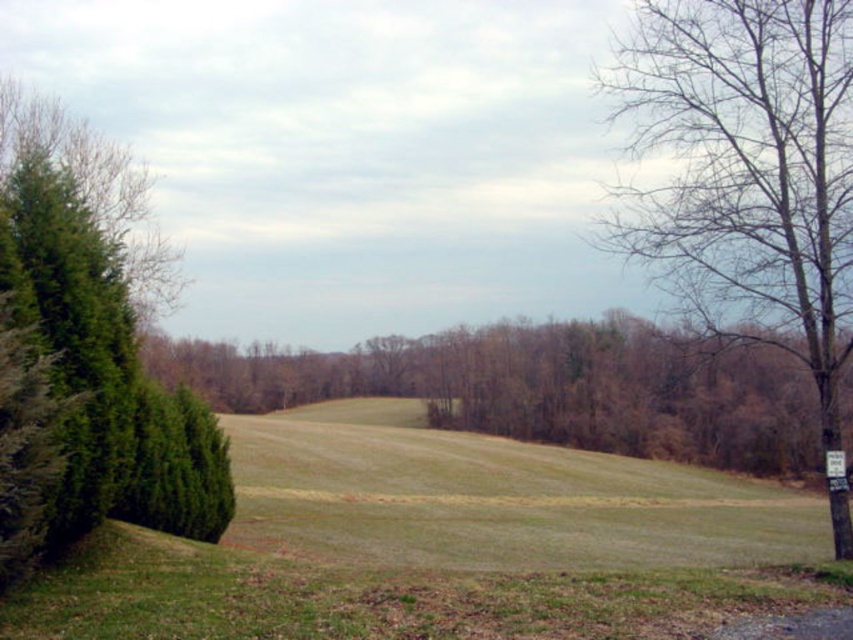
Question: Considering the real-world distances, which object is farthest from the green leafy tree at center?

Choices:
 (A) green textured hedge at left
 (B) bare wood tree at right
 (C) green grassy field at center

Answer: (A)

Question: Is green grassy field at center positioned behind bare wood tree at right?

Choices:
 (A) no
 (B) yes

Answer: (A)

Question: Can you confirm if green grassy field at center is smaller than green leafy tree at center?

Choices:
 (A) yes
 (B) no

Answer: (A)

Question: Which point is closer to the camera taking this photo?

Choices:
 (A) (595, 531)
 (B) (120, 428)
 (C) (599, 348)

Answer: (B)

Question: Can you confirm if green grassy field at center is smaller than green leafy tree at center?

Choices:
 (A) yes
 (B) no

Answer: (A)

Question: Which point appears closest to the camera in this image?

Choices:
 (A) (592, 392)
 (B) (134, 262)

Answer: (B)